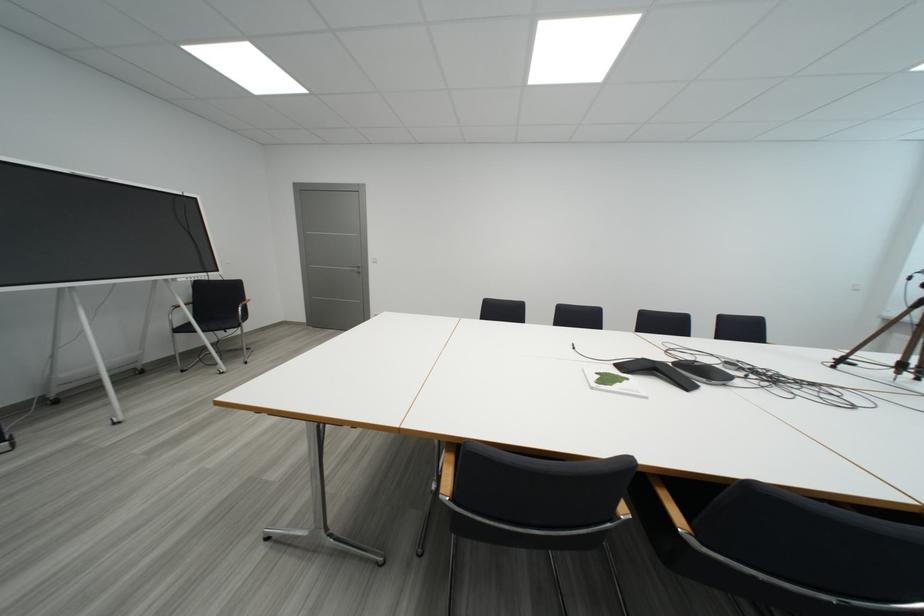
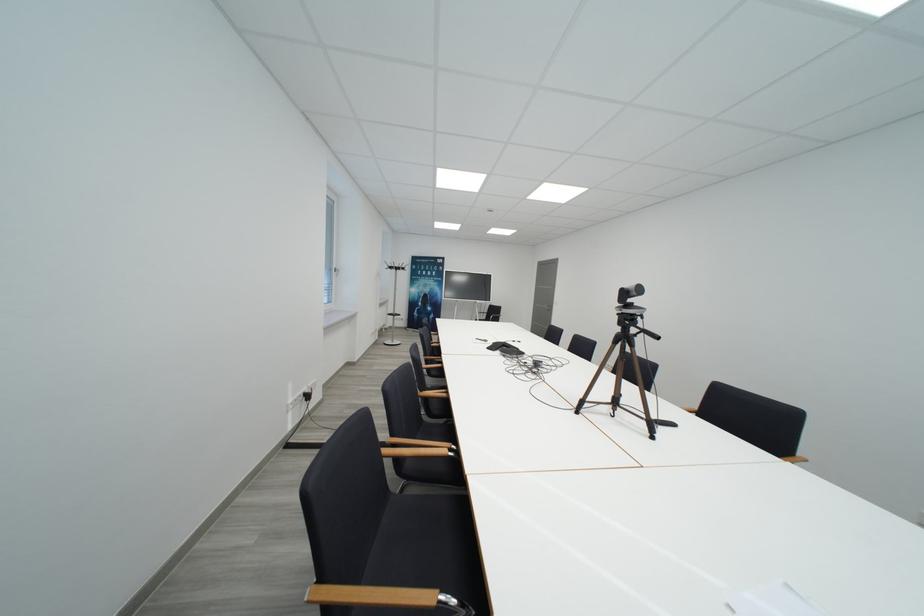
Question: I am providing you with two images of the same scene from different viewpoints. After the viewpoint changes to image2, which objects are now occluded?

Choices:
 (A) silver step ladder
 (B) wooden chair armrest
 (C) black webcam
 (D) black chair sitting surface

Answer: (D)